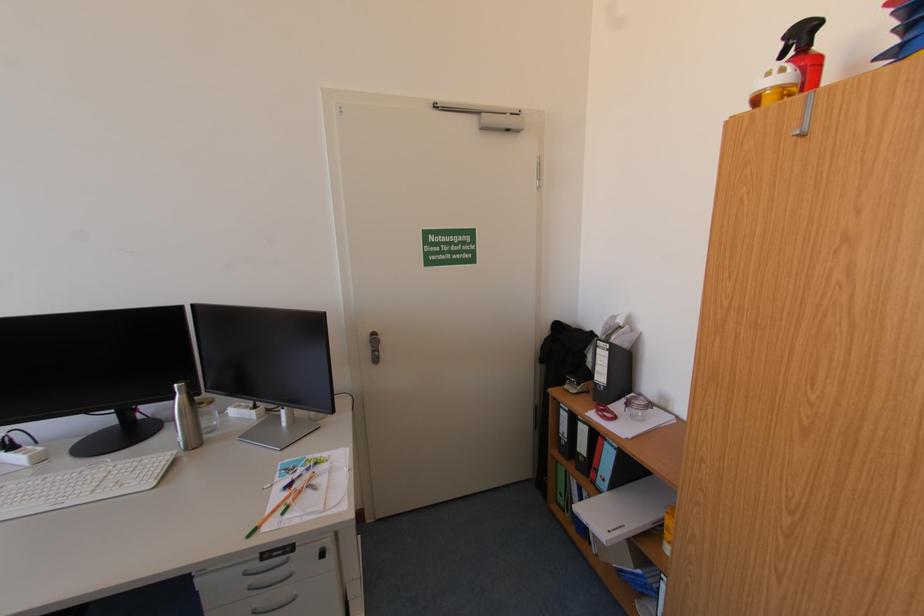
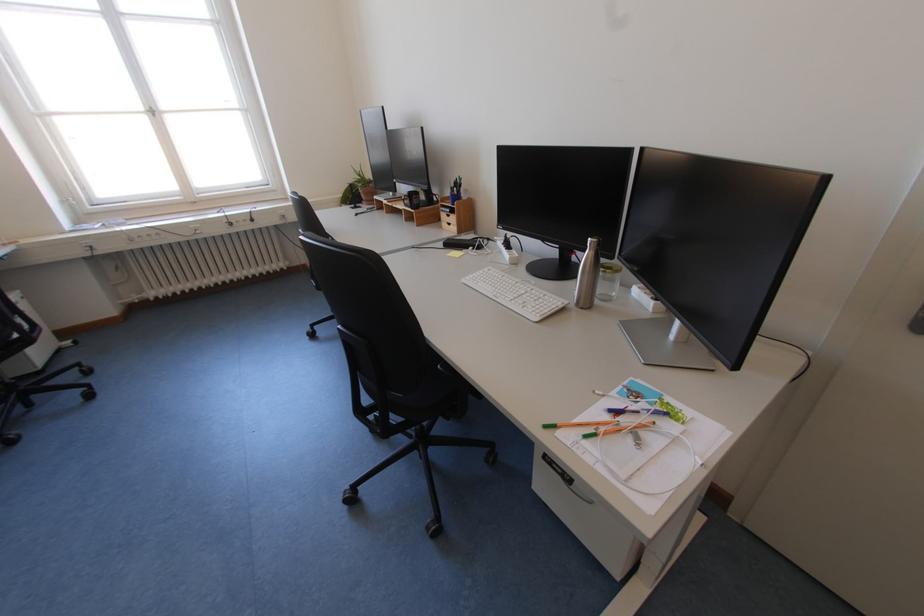
Where in the second image is the point corresponding to the point at 257,537 from the first image?

(553, 428)